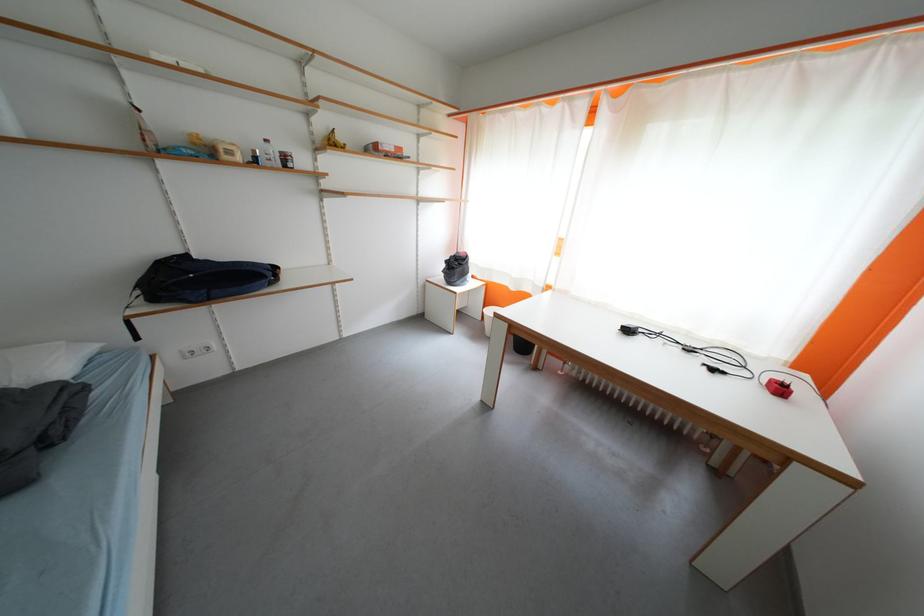
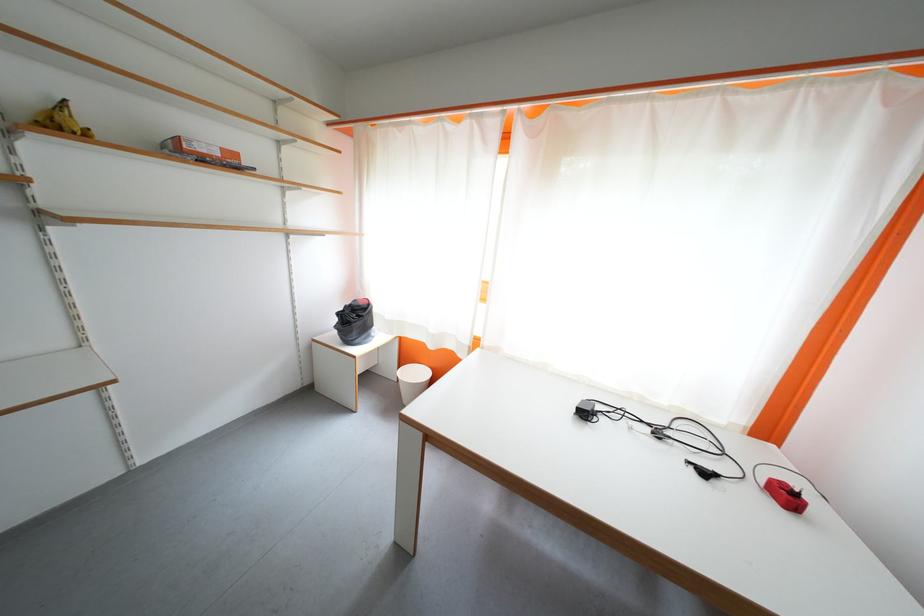
Question: What movement of the cameraman would produce the second image?

Choices:
 (A) Left
 (B) Right
 (C) Forward
 (D) Backward

Answer: (C)